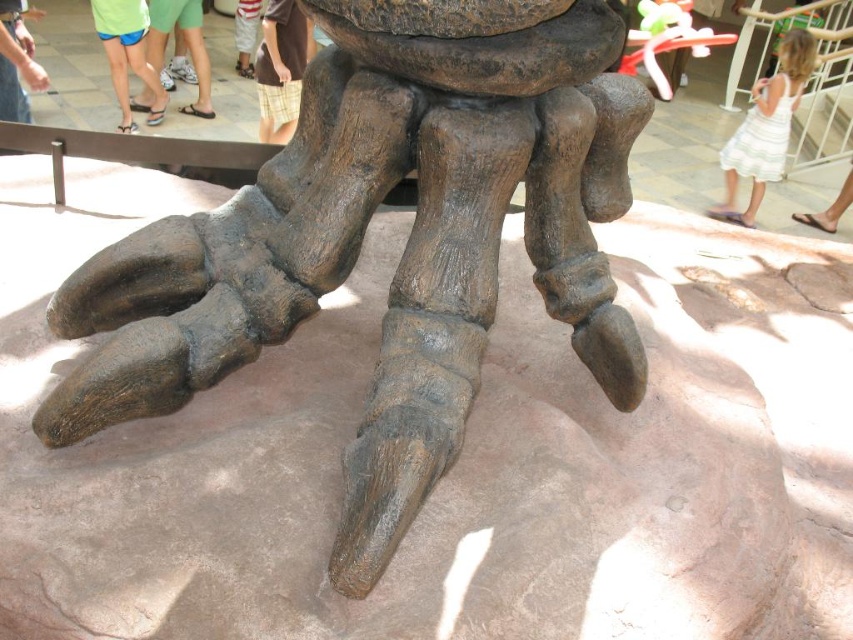
From the picture: You are a tour guide leading a group at the dinosaur exhibit. You notice two visitors wearing brown plaid shorts at center and green fabric shorts at lower left. Which visitor is standing closer to the dinosaur footprint?

The brown plaid shorts at center is taller than the green fabric shorts at lower left, so the brown plaid shorts at center is standing closer to the dinosaur footprint.

You are standing at the point labeled as point [363,236] in the image. What object are you directly facing?

You are directly facing the rough stone dinosaur foot at center.

You are a tour guide at a museum and notice two visitors wearing shorts. One has brown plaid shorts at center and the other has green fabric shorts at lower left. Which visitor is wearing the larger pair of shorts?

The brown plaid shorts at center has a larger size compared to green fabric shorts at lower left, so the visitor wearing the brown plaid shorts at center is wearing the larger pair of shorts.